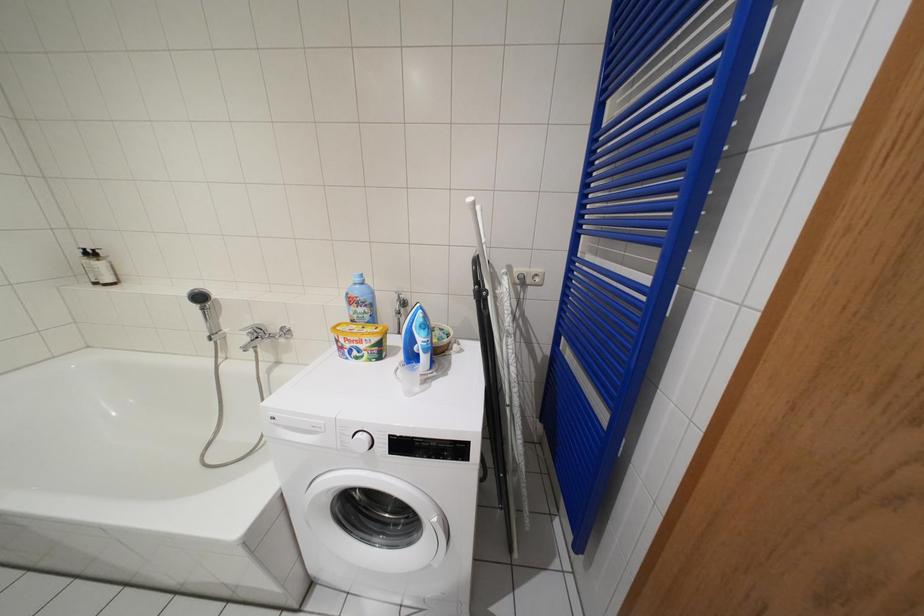
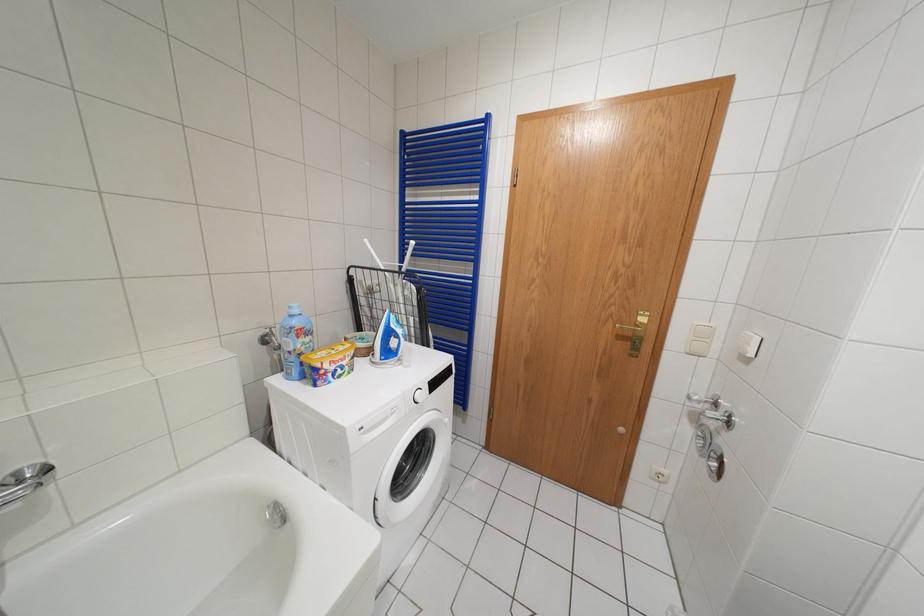
Question: How did the camera likely rotate?

Choices:
 (A) Left
 (B) Right
 (C) Up
 (D) Down

Answer: (B)